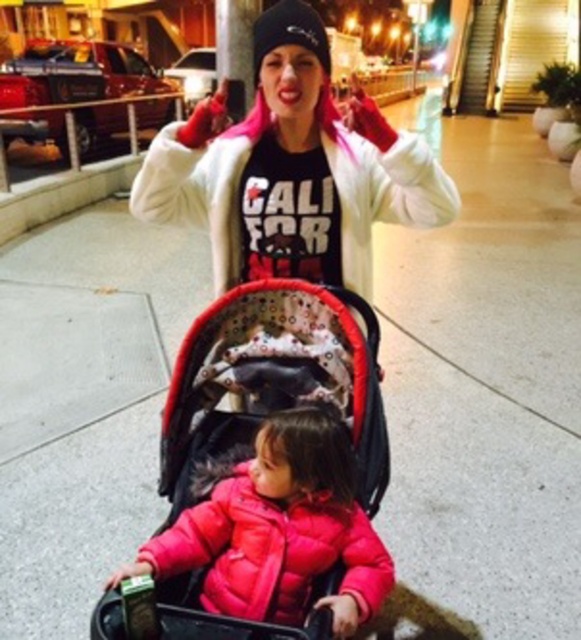
You are a delivery person trying to navigate through a narrow hallway. You see a red fabric baby carriage at center and a matte pink puffer jacket at center in the image. Which object would require more space to maneuver around?

The red fabric baby carriage at center is wider than the matte pink puffer jacket at center, so it would require more space to maneuver around.

You are a photographer trying to capture a candid shot of the woman and her child. You need to ensure there is enough space between the matte white coat at center and the red fabric baby carriage at center to avoid blurring both subjects. The camera you are using has a minimum focus distance of 15 inches. Can you take the photo without moving either object?

The matte white coat at center is 16.94 inches from the red fabric baby carriage at center. Since the camera requires a minimum focus distance of 15 inches, the 16.94 inches between them is sufficient, so yes, you can take the photo without moving either object.

In the scene shown: You are a photographer trying to capture a candid shot of the woman and child. You notice the matte white coat at center and the matte pink puffer jacket at center. Which clothing item is positioned to the right of the other?

The matte white coat at center is positioned to the right of the matte pink puffer jacket at center.